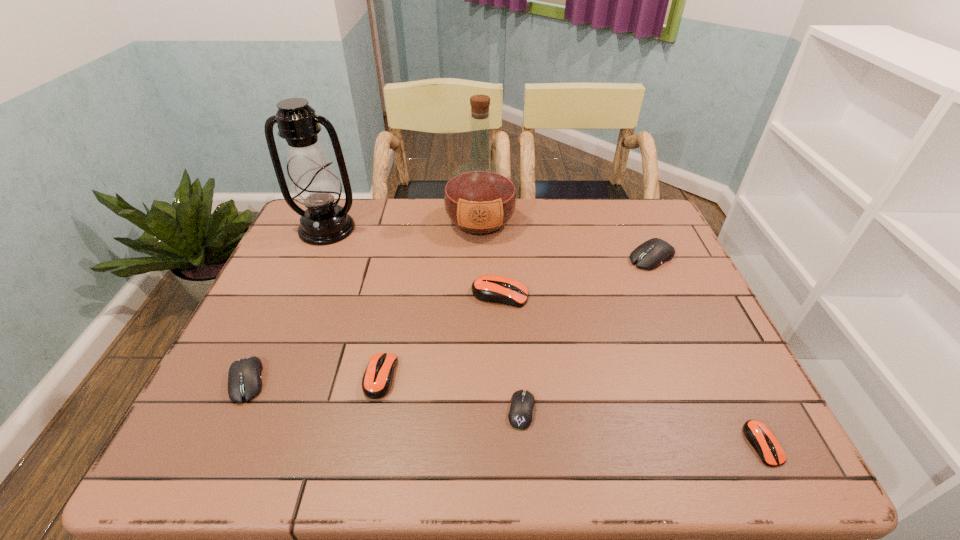
Locate an element on the screen. This screenshot has height=540, width=960. the second black computer equipment from left to right is located at coordinates (522, 403).

Where is `the smallest orange computer mouse`? The height and width of the screenshot is (540, 960). the smallest orange computer mouse is located at coordinates pos(762,439).

This screenshot has width=960, height=540. What are the coordinates of `the rightmost orange computer mouse` in the screenshot? It's located at (762, 439).

In order to click on vacant region located 0.140m on the front label of the pink liquor in this screenshot , I will do `click(480, 275)`.

You are a GUI agent. You are given a task and a screenshot of the screen. Output one action in this format:
    pyautogui.click(x=<x>, y=<y>)
    Task: Click on the vacant area situated on the back of the black oil lamp
    This screenshot has height=540, width=960.
    Given the screenshot: What is the action you would take?
    pyautogui.click(x=338, y=204)

The height and width of the screenshot is (540, 960). I want to click on blank area located on the left of the farthest black computer equipment, so click(x=527, y=257).

Locate an element on the screen. This screenshot has width=960, height=540. vacant space positioned 0.140m on the back of the fourth farthest object is located at coordinates (498, 250).

Image resolution: width=960 pixels, height=540 pixels. Find the location of `free region located on the back of the second smallest black computer equipment`. free region located on the back of the second smallest black computer equipment is located at coordinates (295, 279).

Find the location of a particular element. This screenshot has height=540, width=960. blank space located on the back of the second nearest orange computer mouse is located at coordinates (399, 281).

Find the location of a particular element. blank area located on the right of the smallest black computer equipment is located at coordinates (609, 410).